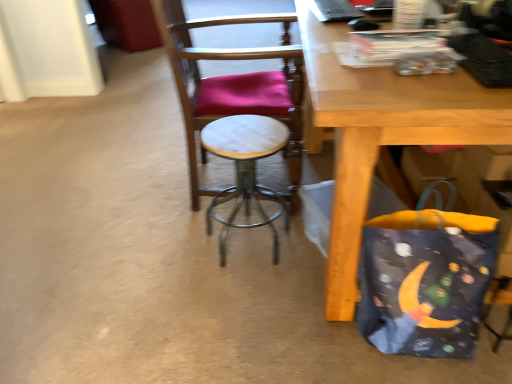
You are a GUI agent. You are given a task and a screenshot of the screen. Output one action in this format:
    pyautogui.click(x=<x>, y=<y>)
    Task: Click on the vacant space in marble seat at center (from a real-world perspective)
    This screenshot has height=384, width=512.
    Given the screenshot: What is the action you would take?
    pyautogui.click(x=258, y=172)